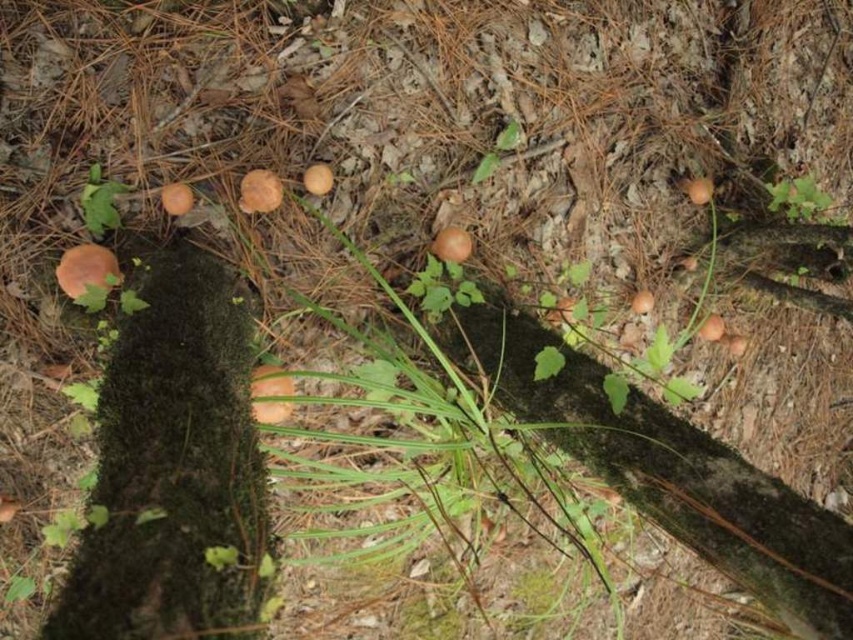
You are a hiker trying to navigate through the forest. You see the green mossy tree trunk at left and the brown matte mushroom at center. Which object is positioned to the right side of the other?

The green mossy tree trunk at left is to the right of the brown matte mushroom at center.

You are navigating through the forest and need to place a small marker at point A and point B. If point A is at point (125, 621) and point B is at point (277, 189), which point is closer to you when you are standing at the center of the image?

Point A at point (125, 621) is closer to you because it is in front of point B at point (277, 189).